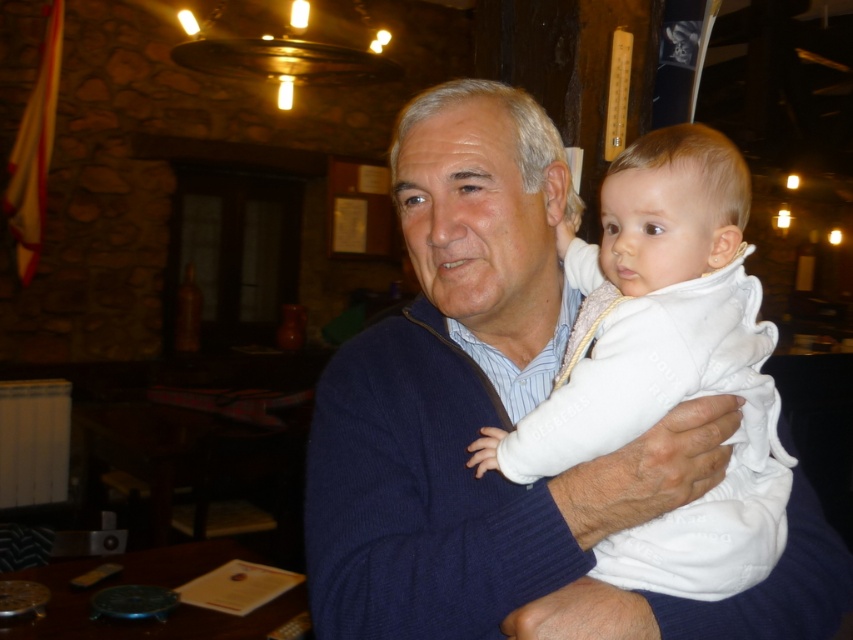
You are a photographer standing at the entrance of the pub. You want to take a closeup photo of the white soft baby at center. The camera requires a minimum distance of 30 inches to focus properly. Can you take the photo without moving closer?

The white soft baby at center and camera are 28.09 inches apart, which is less than the required 30 inches. Therefore, you cannot take the photo without moving closer to maintain proper focus.

You are a photographer in the pub and want to take a photo of the white soft baby at center and the white soft fabric at center. You need to ensure that the baby is positioned to the right of the fabric in the frame. Based on the scene, will the current arrangement allow this?

Yes, the current arrangement allows the white soft baby at center to be positioned to the right of the white soft fabric at center, as described in the scene.

You are a photographer in the pub and want to capture a clear photo of the white soft baby at center without the white soft fabric at center being in the background. Is it possible to adjust your position to achieve this?

The white soft baby at center is positioned over white soft fabric at center, so it is not possible to avoid the fabric being in the background while capturing the baby.